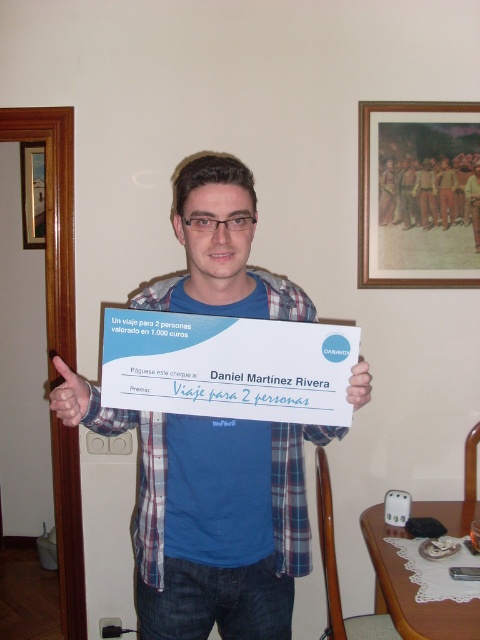
You are organizing a photo shoot and need to decide which item to adjust first. Since the blue plaid shirt at center and the wooden picture frame at upper right are both in the frame, which one should you make smaller to fit more elements into the composition?

The blue plaid shirt at center is bigger than the wooden picture frame at upper right, so you should make the blue plaid shirt at center smaller to fit more elements into the composition.

You are organizing a photo display and need to know which object is wider. You have a wooden picture frame at left and a white paper at center. Which one is wider?

The wooden picture frame at left is wider than the white paper at center according to the description.

You are an interior designer assessing the layout of this room. You notice the blue plaid shirt at center and the wooden picture frame at upper right. Which object occupies more vertical space in the scene?

The blue plaid shirt at center has a greater height compared to the wooden picture frame at upper right, so it occupies more vertical space in the scene.